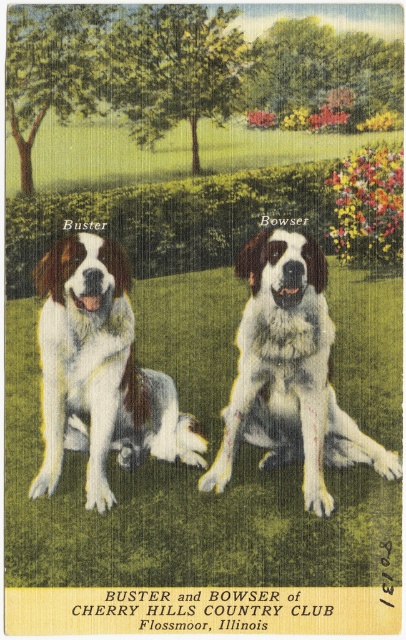
Can you confirm if white fur dog at center is positioned to the right of white fur saint bernard at center?

In fact, white fur dog at center is to the left of white fur saint bernard at center.

This screenshot has height=640, width=406. Describe the element at coordinates (99, 371) in the screenshot. I see `white fur dog at center` at that location.

Find the location of a particular element. white fur dog at center is located at coordinates (99, 371).